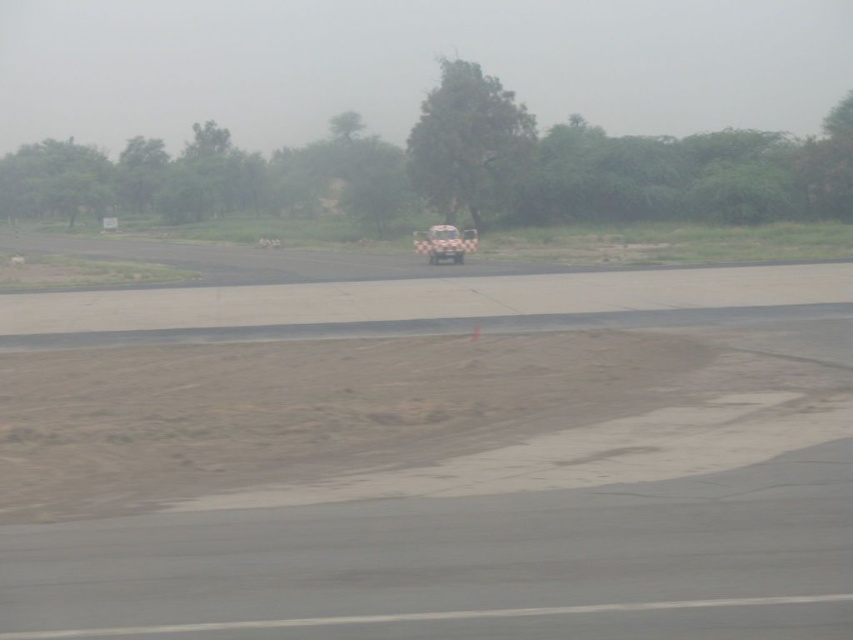
Does brown sandy dirt track at lower left have a larger size compared to white checkered car at center?

Yes.

Is the position of brown sandy dirt track at lower left more distant than that of white checkered car at center?

No.

Describe the element at coordinates (407, 416) in the screenshot. I see `brown sandy dirt track at lower left` at that location.

Locate an element on the screen. This screenshot has height=640, width=853. brown sandy dirt track at lower left is located at coordinates (407, 416).